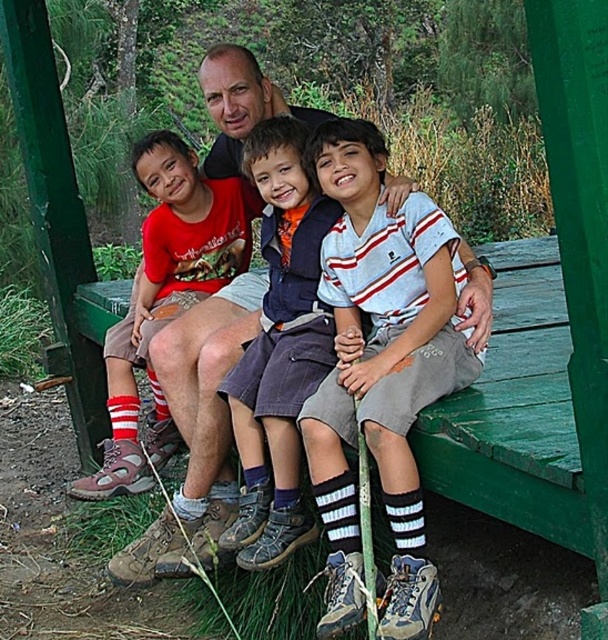
Question: Is the position of matte brown shoes at center more distant than that of red cotton shirt at center?

Choices:
 (A) no
 (B) yes

Answer: (A)

Question: Among these points, which one is nearest to the camera?

Choices:
 (A) (261, 387)
 (B) (415, 360)
 (C) (240, 288)

Answer: (B)

Question: Does white striped socks at lower center have a lesser width compared to matte brown shoes at center?

Choices:
 (A) yes
 (B) no

Answer: (A)

Question: Which object is positioned farthest from the matte brown shoes at center?

Choices:
 (A) red cotton shirt at center
 (B) white striped socks at lower center

Answer: (B)

Question: Which object is farther from the camera taking this photo?

Choices:
 (A) matte brown shoes at center
 (B) striped cotton shirt at center
 (C) red cotton shirt at center
 (D) white striped socks at lower center

Answer: (C)

Question: Does white striped socks at lower center come behind matte brown shoes at center?

Choices:
 (A) yes
 (B) no

Answer: (B)